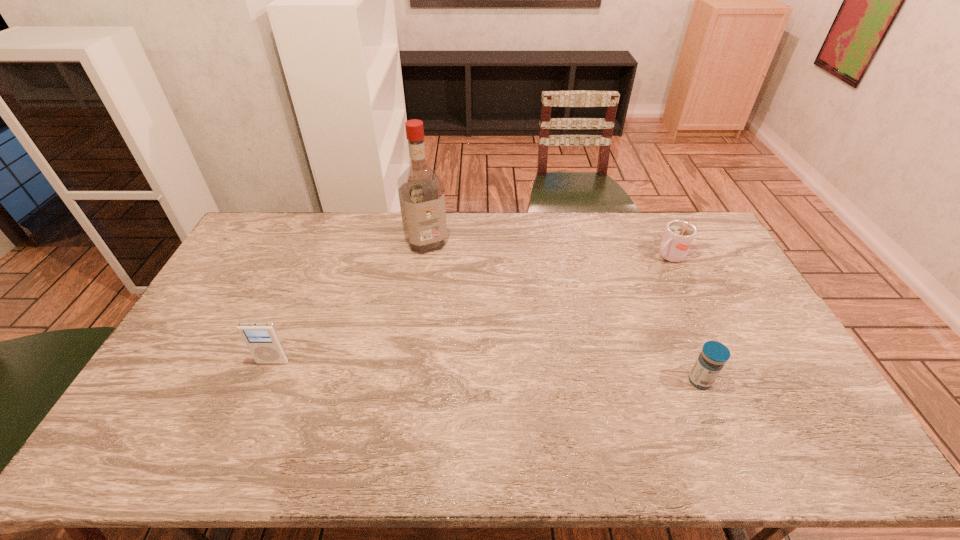
Find the location of `vacant space at the far edge`. vacant space at the far edge is located at coordinates (386, 225).

This screenshot has height=540, width=960. In the image, there is a desktop. What are the coordinates of `vacant space at the left edge` in the screenshot? It's located at (246, 260).

This screenshot has height=540, width=960. In the image, there is a desktop. Identify the location of vacant area at the right edge. (756, 326).

What are the coordinates of `vacant space at the far left corner of the desktop` in the screenshot? It's located at tap(279, 231).

The height and width of the screenshot is (540, 960). Identify the location of free spot at the near left corner of the desktop. (157, 392).

In the image, there is a desktop. Where is `blank space at the near right corner`? This screenshot has height=540, width=960. blank space at the near right corner is located at coordinates (826, 416).

The width and height of the screenshot is (960, 540). Identify the location of free point between the cup and the second object from left to right. (547, 249).

The width and height of the screenshot is (960, 540). I want to click on free area in between the shortest object and the leftmost object, so click(x=487, y=371).

At what (x,y) coordinates should I click in order to perform the action: click on unoccupied area between the medicine and the third farthest object. Please return your answer as a coordinate pair (x, y). This screenshot has width=960, height=540. Looking at the image, I should click on (487, 371).

You are a GUI agent. You are given a task and a screenshot of the screen. Output one action in this format:
    pyautogui.click(x=<x>, y=<y>)
    Task: Click on the vacant space in between the medicine and the leftmost object
    
    Given the screenshot: What is the action you would take?
    pyautogui.click(x=487, y=371)